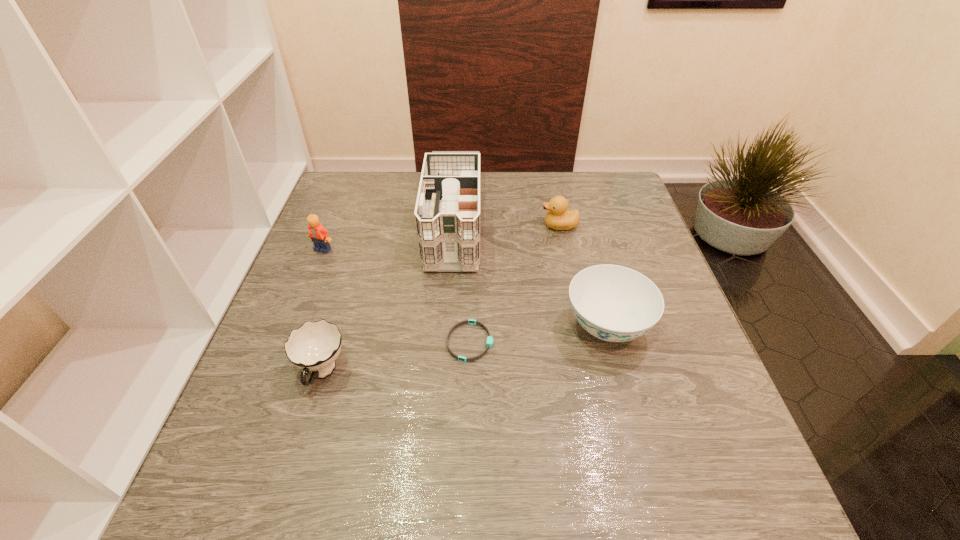
Where is `vacant space located facing forward on the duckling`? This screenshot has width=960, height=540. vacant space located facing forward on the duckling is located at coordinates (406, 226).

Locate an element on the screen. The width and height of the screenshot is (960, 540). free space located facing forward on the duckling is located at coordinates (414, 226).

This screenshot has width=960, height=540. Find the location of `vacant space located 0.070m on the side of the second object from left to right with the handle`. vacant space located 0.070m on the side of the second object from left to right with the handle is located at coordinates (302, 438).

This screenshot has width=960, height=540. I want to click on free space located 0.070m on the buckle of the shortest object, so click(526, 342).

The width and height of the screenshot is (960, 540). Find the location of `object that is at the far edge`. object that is at the far edge is located at coordinates (447, 214).

At what (x,y) coordinates should I click in order to perform the action: click on Lego at the left edge. Please return your answer as a coordinate pair (x, y). Image resolution: width=960 pixels, height=540 pixels. Looking at the image, I should click on (319, 235).

This screenshot has height=540, width=960. I want to click on cup present at the left edge, so click(313, 347).

I want to click on object located in the right edge section of the desktop, so click(x=614, y=303).

Find the location of a particular element. The height and width of the screenshot is (540, 960). vacant space at the far edge of the desktop is located at coordinates (533, 173).

Identify the location of vacant area at the near edge. The height and width of the screenshot is (540, 960). [447, 495].